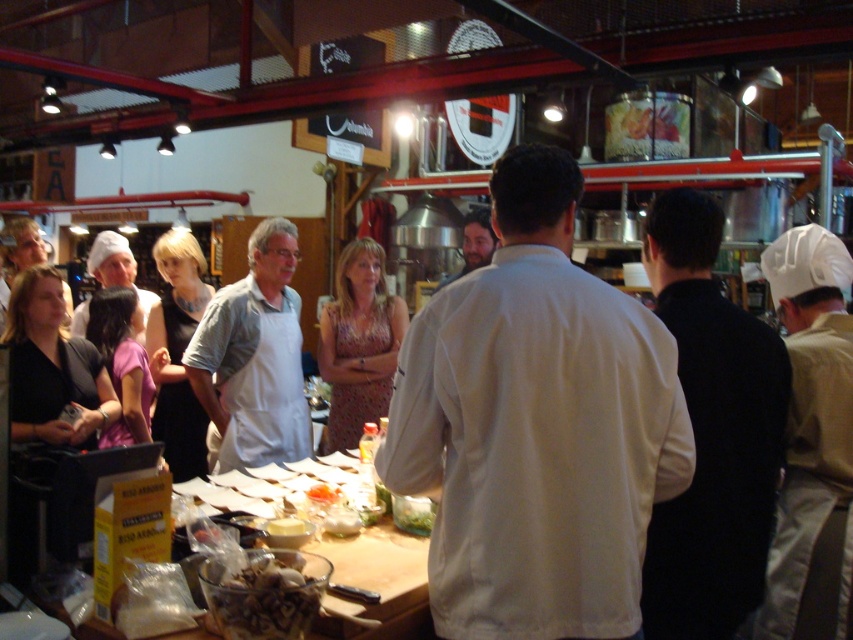
You are a participant in the cooking class and need to place the translucent glass bowl at center on top of the black matte apron at center. Is this possible based on their sizes?

The black matte apron at center is larger in size than the translucent glass bowl at center, so yes, the bowl can be placed on the apron as it will fit within the apron.

You are standing at the back of the room and want to grab the beige fabric chef hat at center to adjust it. Considering your height is 5 feet 6 inches, can you reach it without moving closer?

The beige fabric chef hat at center is 13.47 feet away from the camera. Since you are 5 feet 6 inches tall, you would need to move closer to reach it as the distance is too far to reach from your current position.

You are a participant in the cooking class and need to grab the white creamy cheese at center. However, there is a white fabric chef hat at right in the way. Can you easily reach the cheese without moving the hat?

The white fabric chef hat at right is bigger than the white creamy cheese at center, so it might block access. However, since the cheese is at the center and the hat is at the right, you might still reach around or over the hat depending on its placement. But since the hat is larger, it could be more obstructive. Without knowing exact distances, it is uncertain.